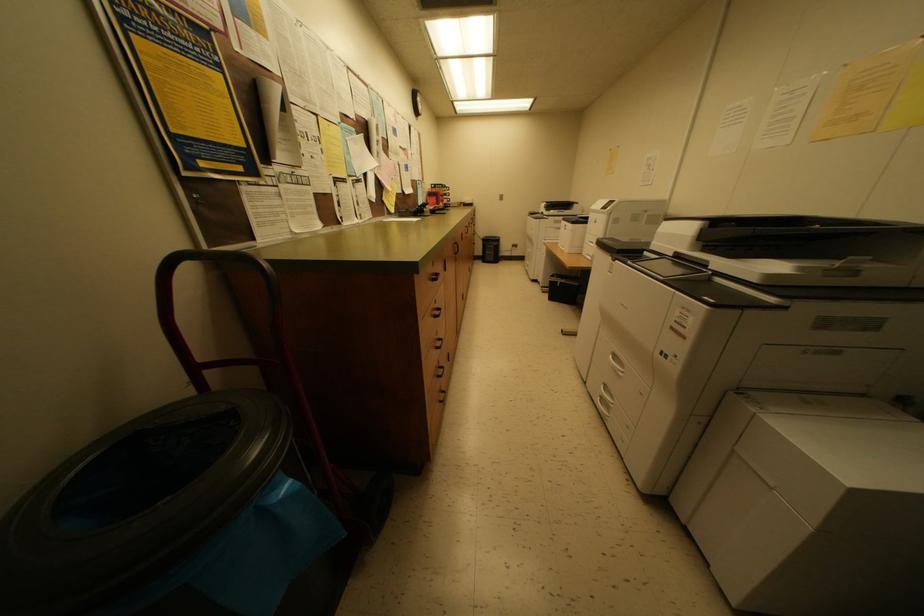
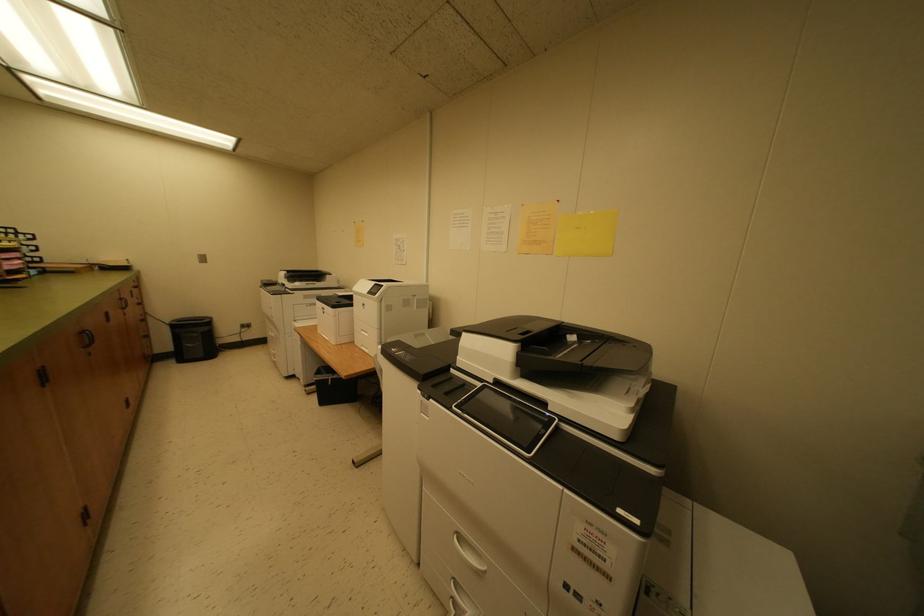
Question: Based on the continuous images, in which direction is the camera rotating? Reply with the corresponding letter.

Choices:
 (A) Left
 (B) Right
 (C) Up
 (D) Down

Answer: (B)